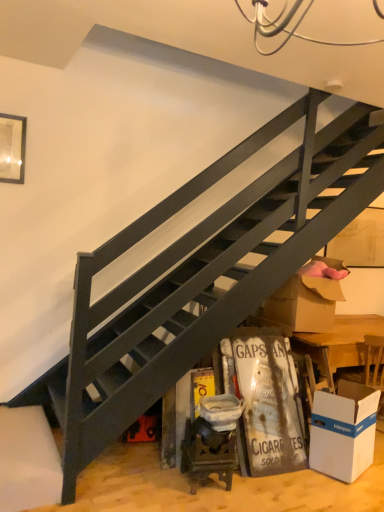
Question: From the image's perspective, is brown cardboard box at lower right positioned above or below white cardboard box at lower right?

Choices:
 (A) below
 (B) above

Answer: (B)

Question: In terms of width, does brown cardboard box at lower right look wider or thinner when compared to white cardboard box at lower right?

Choices:
 (A) wide
 (B) thin

Answer: (A)

Question: Is brown cardboard box at lower right taller or shorter than white cardboard box at lower right?

Choices:
 (A) short
 (B) tall

Answer: (B)

Question: From a real-world perspective, relative to brown cardboard box at lower right, is white cardboard box at lower right vertically above or below?

Choices:
 (A) above
 (B) below

Answer: (B)

Question: Considering the positions of point (349, 415) and point (271, 308), is point (349, 415) closer or farther from the camera than point (271, 308)?

Choices:
 (A) closer
 (B) farther

Answer: (A)

Question: From their relative heights in the image, would you say white cardboard box at lower right is taller or shorter than brown cardboard box at lower right?

Choices:
 (A) short
 (B) tall

Answer: (A)

Question: Considering the relative positions of white cardboard box at lower right and brown cardboard box at lower right in the image provided, is white cardboard box at lower right to the left or to the right of brown cardboard box at lower right?

Choices:
 (A) left
 (B) right

Answer: (B)